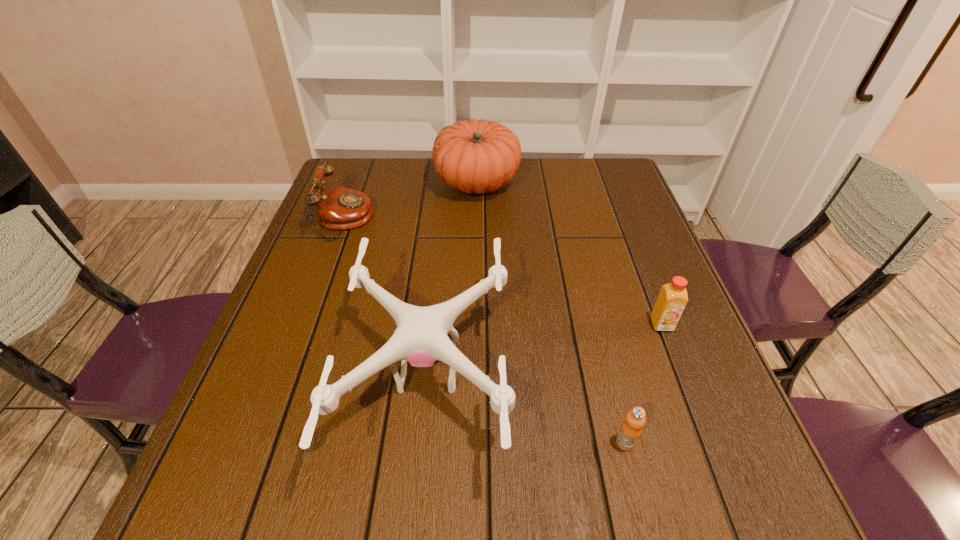
Locate an element on the screen. The image size is (960, 540). vacant space at the right edge is located at coordinates (639, 315).

Where is `vacant space at the far left corner of the desktop`? vacant space at the far left corner of the desktop is located at coordinates (381, 178).

The image size is (960, 540). I want to click on vacant space at the far right corner of the desktop, so click(x=600, y=162).

This screenshot has height=540, width=960. In order to click on free space between the taller orange juice and the pumpkin in this screenshot , I will do `click(569, 253)`.

Identify the location of vacant region between the left orange juice and the pumpkin. (551, 313).

I want to click on vacant area that lies between the drone and the pumpkin, so click(452, 278).

Locate an element on the screen. The image size is (960, 540). empty space between the drone and the shorter orange juice is located at coordinates (527, 408).

Identify the location of free space between the drone and the pumpkin. This screenshot has width=960, height=540. pyautogui.click(x=452, y=278).

At what (x,y) coordinates should I click in order to perform the action: click on unoccupied area between the drone and the shortest object. Please return your answer as a coordinate pair (x, y). The height and width of the screenshot is (540, 960). Looking at the image, I should click on (527, 408).

Locate an element on the screen. vacant point located between the pumpkin and the drone is located at coordinates (452, 278).